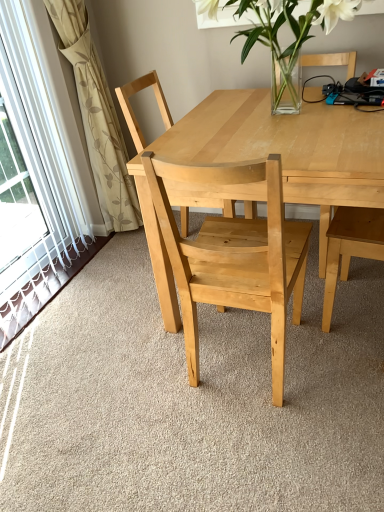
The height and width of the screenshot is (512, 384). I want to click on free space below natural wood chair at center, the 1th chair viewed from the front (from a real-world perspective), so click(248, 373).